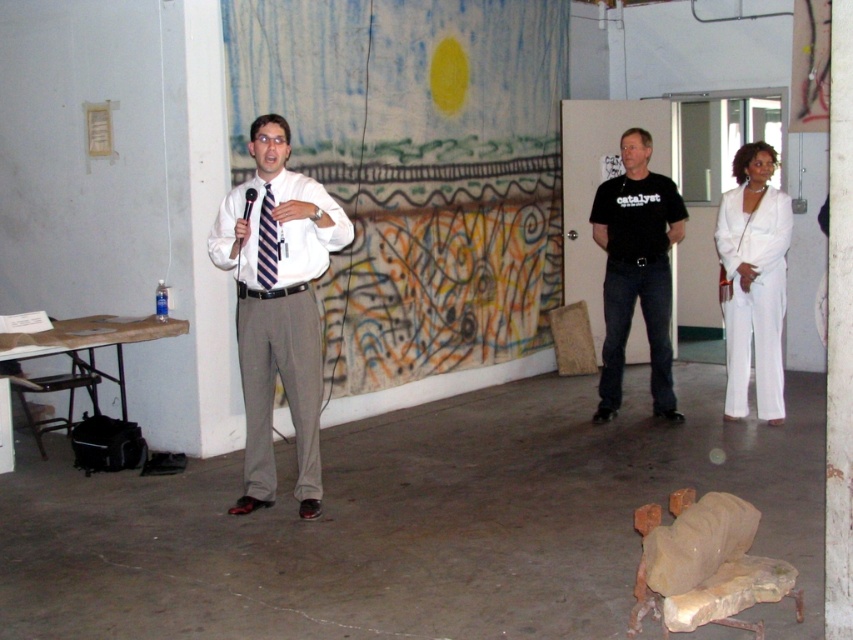
You are an event planner arranging seating for a presentation. You need to seat two speakers wearing the white satin pantsuit at right and striped fabric tie at center. Which speaker should you seat first to ensure they can be seen by the audience?

The white satin pantsuit at right should be seated first because they are much taller than the striped fabric tie at center, so placing them in a front row would allow both speakers to be seen by the audience.

You are standing in the room and want to move from the point at coordinates [746,236] to the point at coordinates [223,243]. Which direction should you move to get closer to the camera?

You should move toward the point at coordinates [223,243] because it is closer to the camera compared to the point at coordinates [746,236].